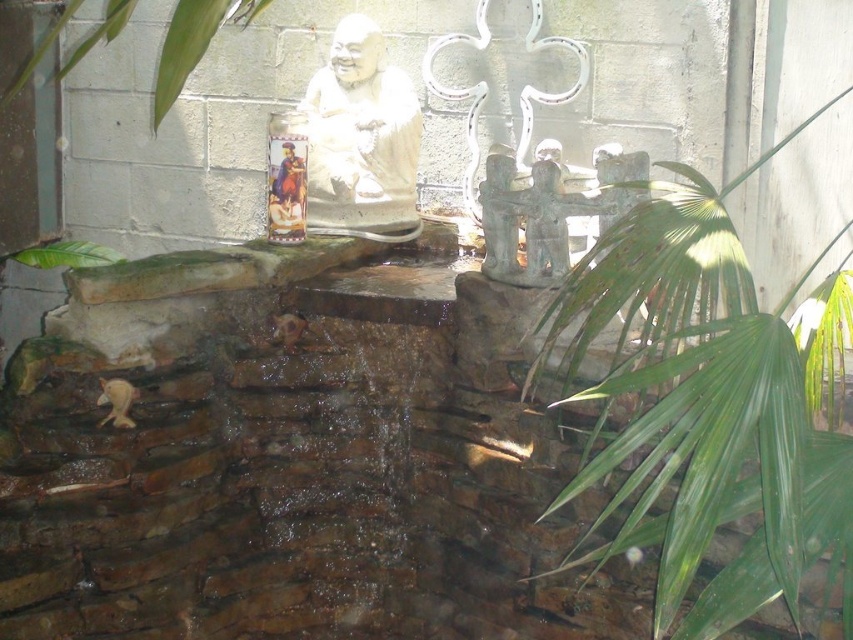
You are standing at the viewpoint of the image and want to place a small decorative rock between the two points, point (364,58) and point (61,244). Which point should the rock be closer to in order to be positioned in front of the second point?

The rock should be closer to point (364,58) because it is in front of point (61,244).

You are a visitor in this garden and want to take a photo of the white stone statue at center and the green leafy plant at upper left together in the frame. Which object should you place closer to the camera to ensure both are in focus?

To ensure both the white stone statue at center and the green leafy plant at upper left are in focus, you should place the green leafy plant at upper left closer to the camera since the white stone statue at center is positioned on the right side of it, meaning it is farther away from the camera.

You are planning to place a new decorative item in the garden scene. The item you want to place is exactly the same height as the green leafy plant at left. Where should you place it so that it doesn not block the view of the white stone statue at center?

You should place the new decorative item at the same position as the green leafy plant at left since it is shorter than the white stone statue at center, ensuring it won not block the view.